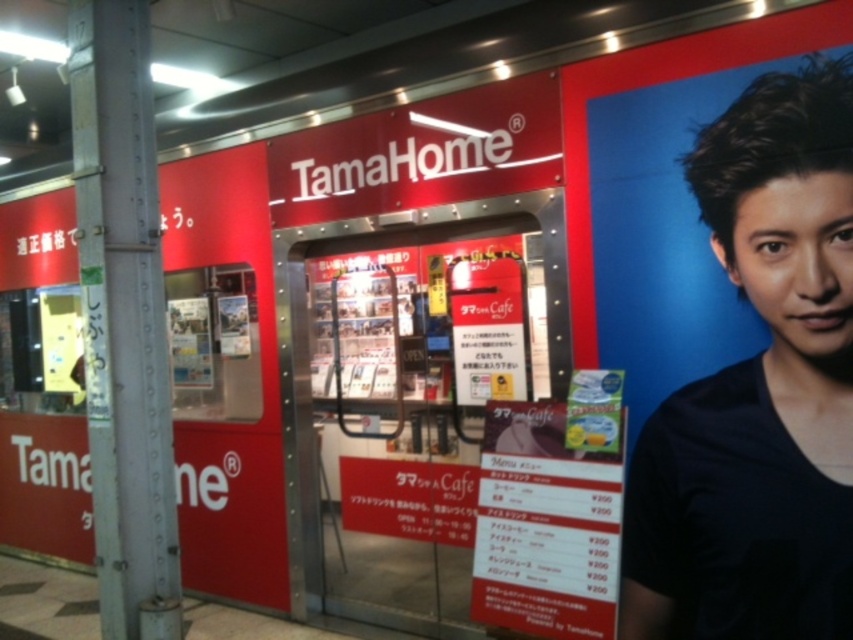
Question: Does black matte shirt at right appear under metallic gray pole at left?

Choices:
 (A) yes
 (B) no

Answer: (A)

Question: Which of the following is the farthest from the observer?

Choices:
 (A) black matte shirt at right
 (B) metallic gray pole at left

Answer: (B)

Question: Does black matte shirt at right have a lesser width compared to metallic gray pole at left?

Choices:
 (A) no
 (B) yes

Answer: (A)

Question: Is black matte shirt at right in front of metallic gray pole at left?

Choices:
 (A) yes
 (B) no

Answer: (A)

Question: Among these objects, which one is farthest from the camera?

Choices:
 (A) black matte shirt at right
 (B) metallic gray pole at left

Answer: (B)

Question: Which object appears closest to the camera in this image?

Choices:
 (A) black matte shirt at right
 (B) metallic gray pole at left

Answer: (A)